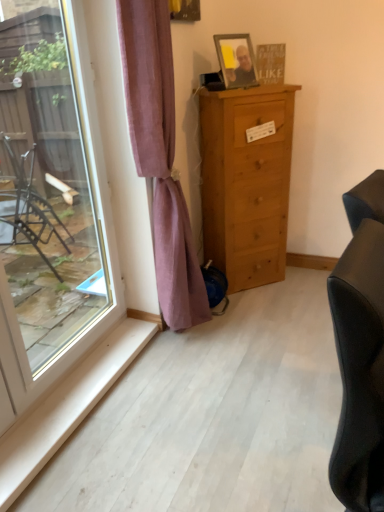
You are a GUI agent. You are given a task and a screenshot of the screen. Output one action in this format:
    pyautogui.click(x=<x>, y=<y>)
    Task: Click on the vacant region in front of wooden framed photo at upper center
    This screenshot has width=384, height=512.
    Given the screenshot: What is the action you would take?
    pyautogui.click(x=241, y=90)